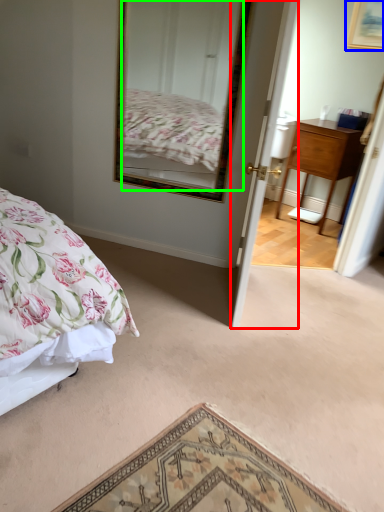
Question: Which object is the farthest from door (highlighted by a red box)? Choose among these: picture frame (highlighted by a blue box) or mirror (highlighted by a green box).

Choices:
 (A) picture frame
 (B) mirror

Answer: (A)